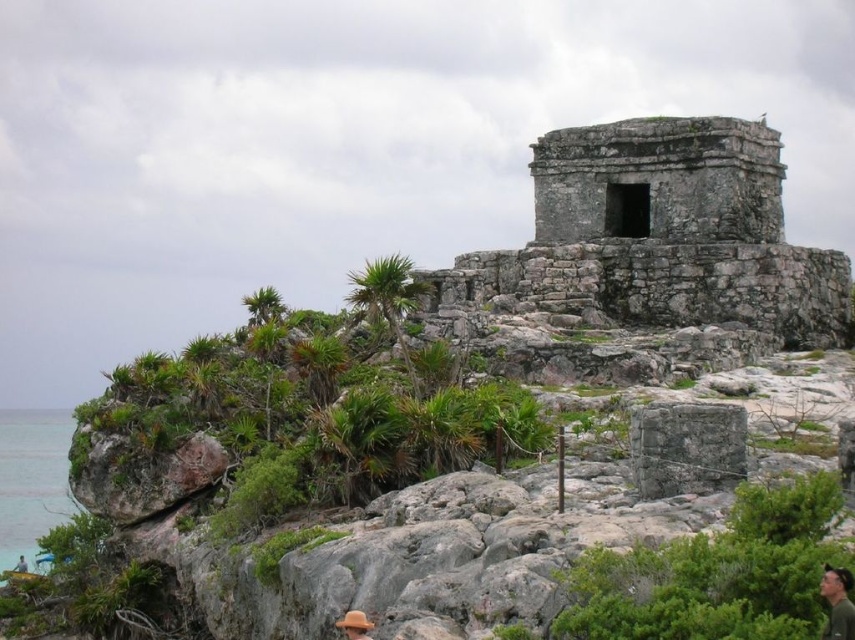
You are a tourist standing at the ancient stone structure and want to take a photo that includes both the clear blue water at lower left and the green leafy palm tree at center. Which object will appear larger in the photo?

The clear blue water at lower left will appear larger in the photo because it is taller than the green leafy palm tree at center.

You are an archaeologist examining the ancient stone structure. You notice the gray stone at center and the green fabric cap at upper right. Which object is wider?

The gray stone at center has a lesser width compared to green fabric cap at upper right, so the green fabric cap at upper right is wider.

You are a tour guide explaining the ancient stone structure to visitors. You point out the green leafy plants at center and the green fabric cap at upper right. Which object is taller in the scene?

The green leafy plants at center are much taller than the green fabric cap at upper right.